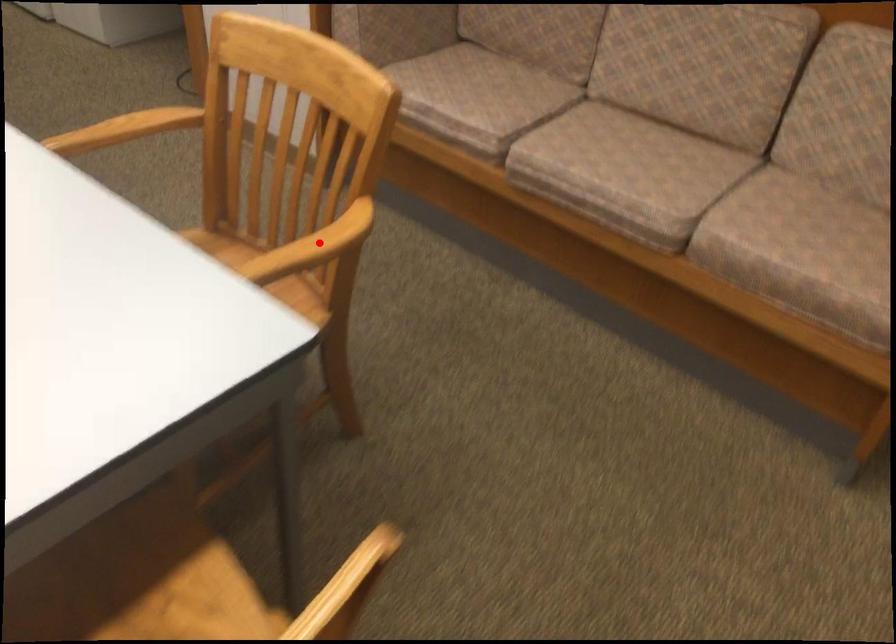
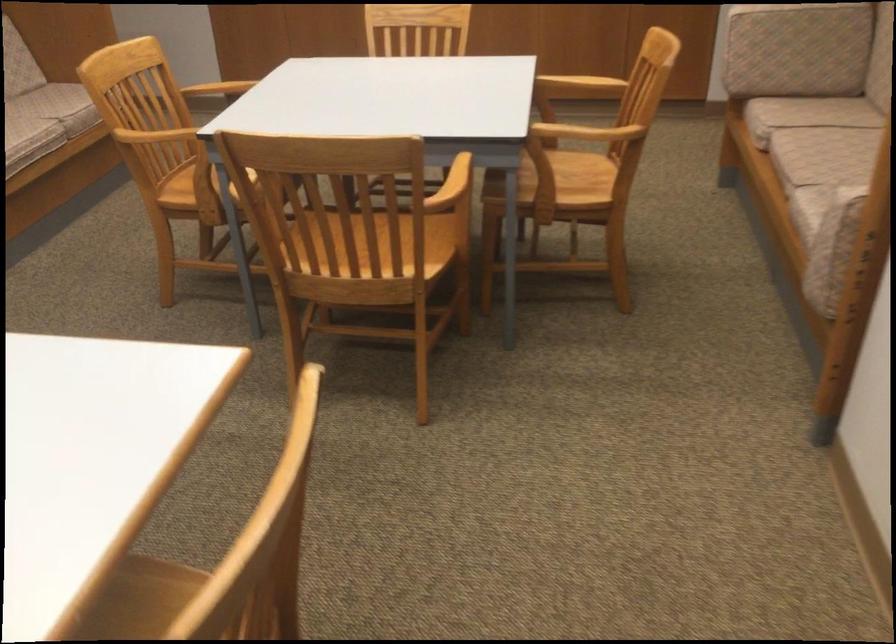
Find the pixel in the second image that matches the highlighted location in the first image.

(218, 89)